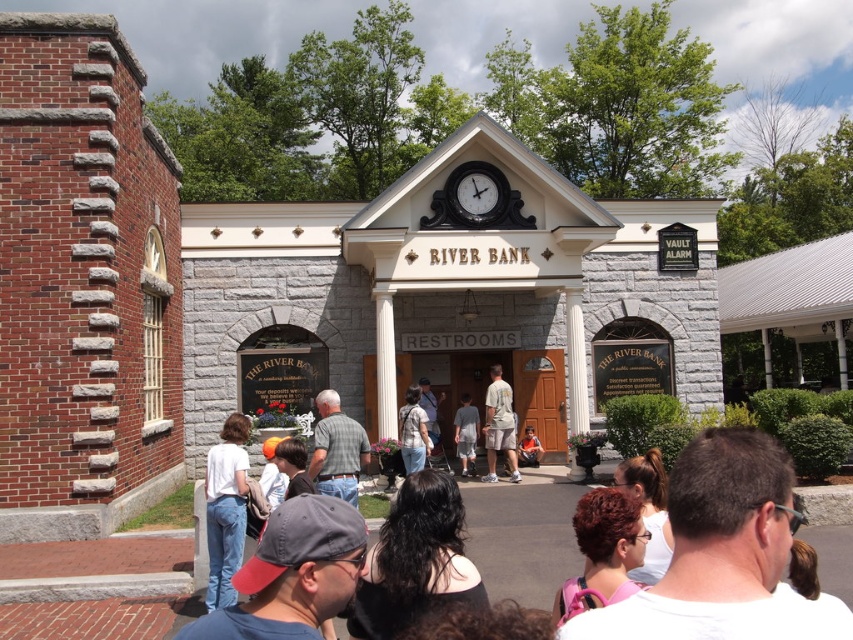
Can you confirm if denim shirt at center is wider than gray cotton shorts at center?

Indeed, denim shirt at center has a greater width compared to gray cotton shorts at center.

Does point (422, 449) come behind point (454, 420)?

No, it is in front of (454, 420).

Does point (409, 422) come in front of point (457, 445)?

That is True.

I want to click on denim shirt at center, so click(x=413, y=433).

Is white cotton shirt at center bigger than light brown fabric shorts at center?

Yes.

Locate an element on the screen. This screenshot has height=640, width=853. white cotton shirt at center is located at coordinates (225, 509).

This screenshot has width=853, height=640. What do you see at coordinates (225, 509) in the screenshot? I see `white cotton shirt at center` at bounding box center [225, 509].

In order to click on white cotton shirt at center in this screenshot , I will do `click(225, 509)`.

Does point (238, 435) come in front of point (463, 456)?

Yes, it is in front of point (463, 456).

This screenshot has width=853, height=640. I want to click on white cotton shirt at center, so click(x=225, y=509).